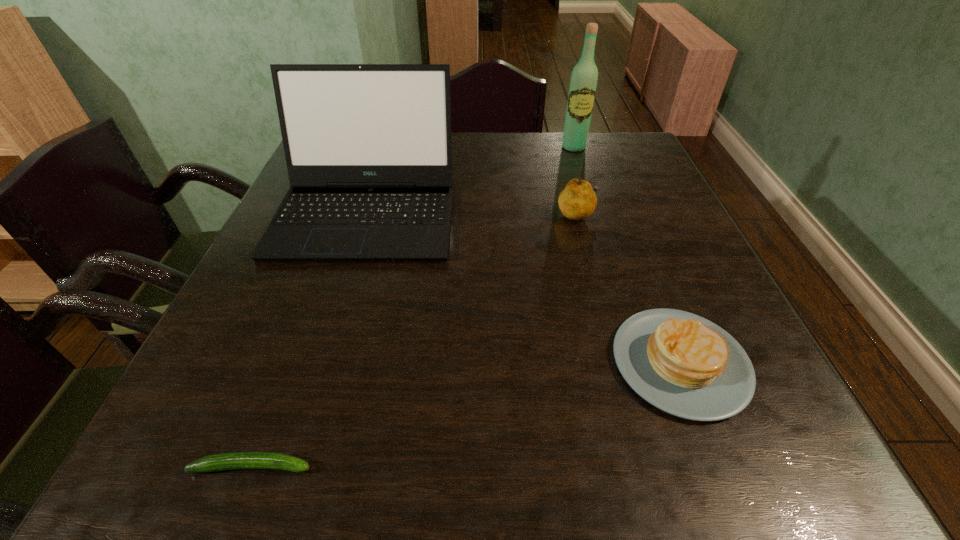
You are a GUI agent. You are given a task and a screenshot of the screen. Output one action in this format:
    pyautogui.click(x=<x>, y=<y>)
    Task: Click on the vacant space that satisfies the following two spatial constraints: 1. on the front-facing side of the farthest object; 2. on the left side of the pancake
    The height and width of the screenshot is (540, 960).
    Given the screenshot: What is the action you would take?
    pyautogui.click(x=641, y=363)

Where is `free space that satisfies the following two spatial constraints: 1. on the surface of the second tallest object; 2. on the right side of the third shortest object`? free space that satisfies the following two spatial constraints: 1. on the surface of the second tallest object; 2. on the right side of the third shortest object is located at coordinates (366, 214).